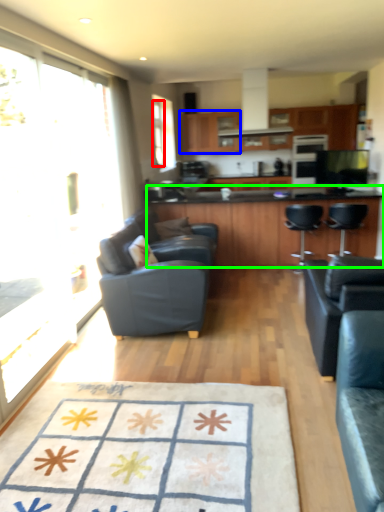
Question: Based on their relative distances, which object is nearer to window (highlighted by a red box)? Choose from cabinetry (highlighted by a blue box) and countertop (highlighted by a green box).

Choices:
 (A) cabinetry
 (B) countertop

Answer: (A)